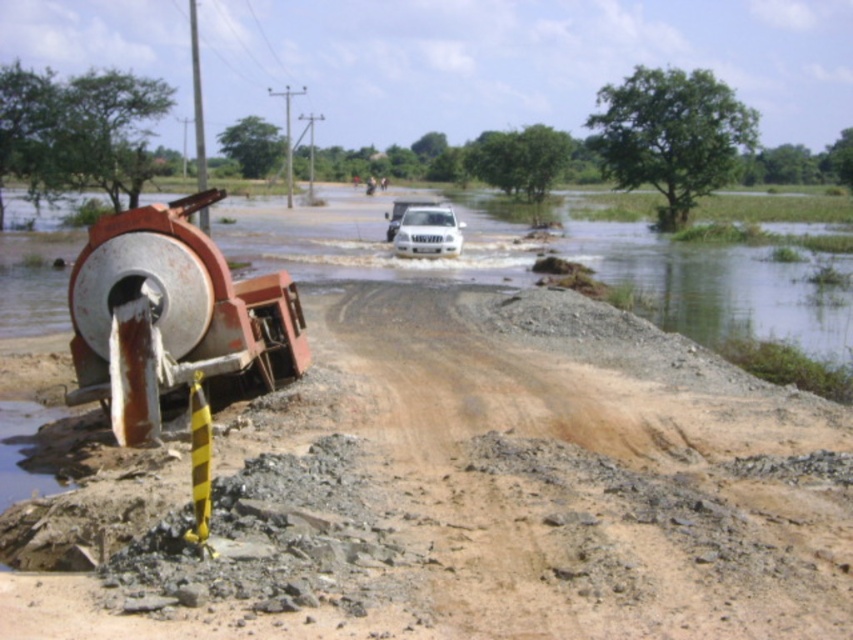
Question: Which of the following is the farthest from the observer?

Choices:
 (A) (415, 252)
 (B) (224, 577)

Answer: (A)

Question: Is brown gravel dirt track at center to the left of white matte suv at center from the viewer's perspective?

Choices:
 (A) no
 (B) yes

Answer: (B)

Question: Which point is farther to the camera?

Choices:
 (A) (402, 486)
 (B) (427, 244)

Answer: (B)

Question: Does brown gravel dirt track at center appear on the right side of white matte suv at center?

Choices:
 (A) yes
 (B) no

Answer: (B)

Question: Among these points, which one is nearest to the camera?

Choices:
 (A) (424, 256)
 (B) (593, 320)

Answer: (B)

Question: Observing the image, what is the correct spatial positioning of brown gravel dirt track at center in reference to white matte suv at center?

Choices:
 (A) right
 (B) left

Answer: (B)